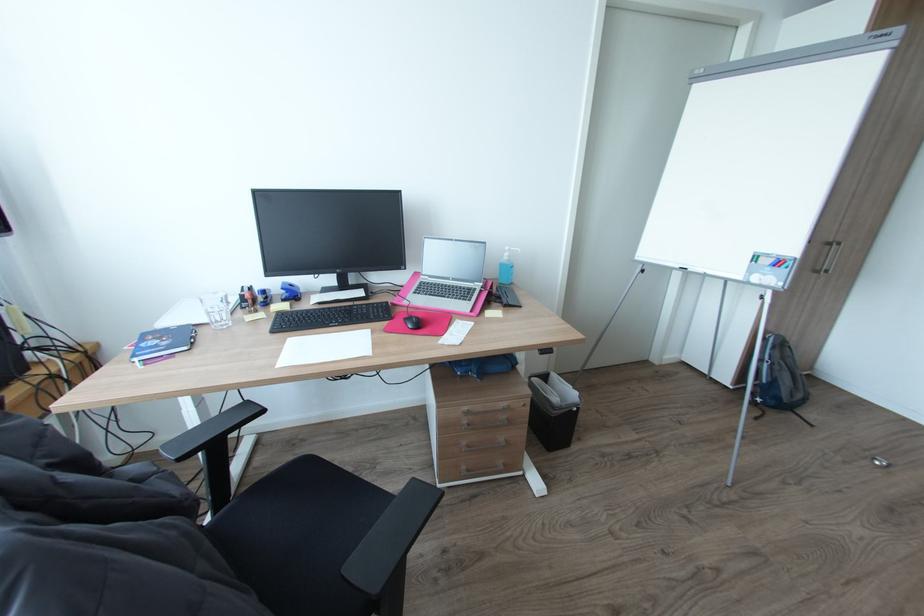
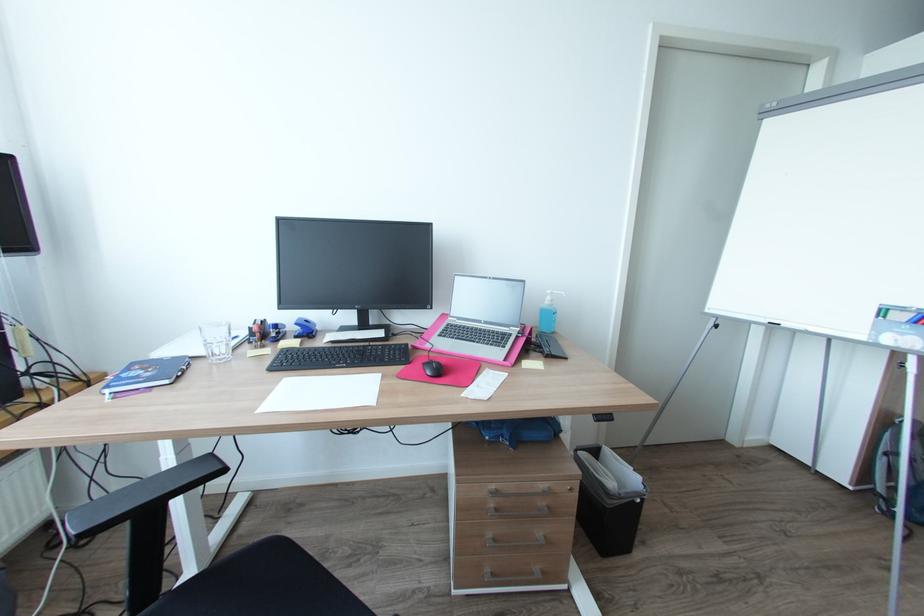
Question: The images are taken continuously from a first-person perspective. In which direction are you moving?

Choices:
 (A) Left
 (B) Right
 (C) Forward
 (D) Backward

Answer: (C)